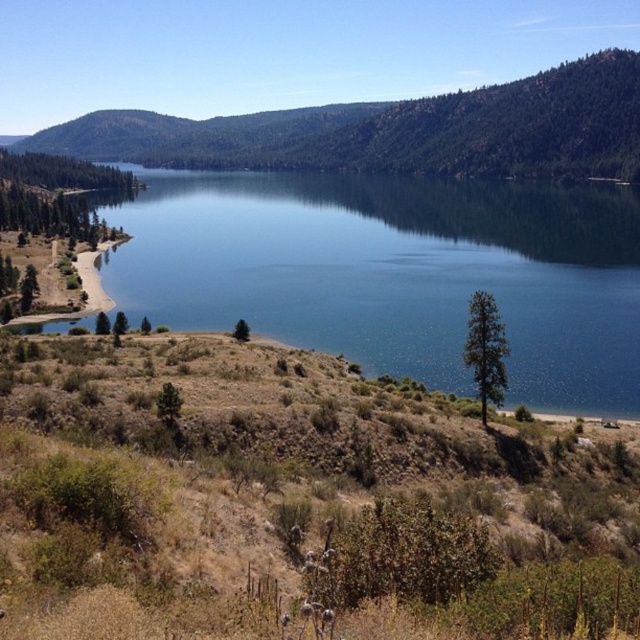
You are a hiker standing on the dry grassy hillside looking towards the blue reflective water at center and the green forested mountain at upper center. Which object is positioned higher in the scene?

The green forested mountain at upper center is positioned higher than the blue reflective water at center, as it is located above it in the scene.

You are standing at the edge of the lake and want to take a photo of two points in the scene. The first point is at coordinate point (67, 326) and the second is at point (624, 109). Which point will appear larger in your photo?

Point (67, 326) will appear larger in the photo because it is closer to the camera than point (624, 109).